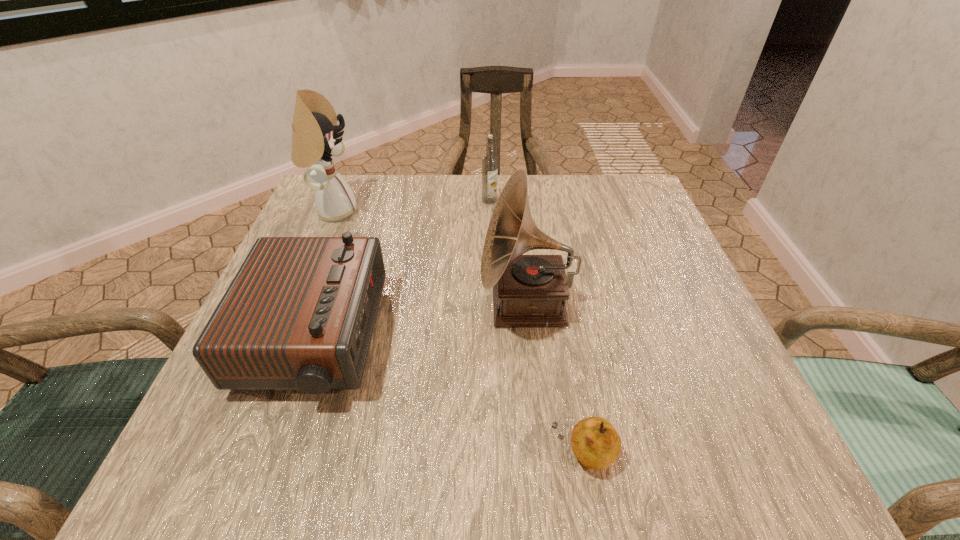
Where is `doll`? doll is located at coordinates (314, 140).

Find the location of a particular element. The width and height of the screenshot is (960, 540). phonograph record is located at coordinates (528, 290).

I want to click on the third shortest object, so click(489, 162).

At what (x,y) coordinates should I click in order to perform the action: click on radio receiver. Please return your answer as a coordinate pair (x, y). Looking at the image, I should click on (299, 314).

You are a GUI agent. You are given a task and a screenshot of the screen. Output one action in this format:
    pyautogui.click(x=<x>, y=<y>)
    Task: Click on the nearest object
    This screenshot has height=540, width=960.
    Given the screenshot: What is the action you would take?
    pyautogui.click(x=596, y=444)

The image size is (960, 540). What are the coordinates of `the shortest object` in the screenshot? It's located at (596, 444).

Where is `vacant position located 0.160m at the front face of the doll`? The image size is (960, 540). vacant position located 0.160m at the front face of the doll is located at coordinates (425, 211).

Locate an element on the screen. vacant area located 0.170m on the horn of the phonograph record is located at coordinates (390, 305).

Image resolution: width=960 pixels, height=540 pixels. What are the coordinates of `vacant region located on the horn of the phonograph record` in the screenshot? It's located at (277, 305).

Where is `vacant space located on the horn of the phonograph record`? vacant space located on the horn of the phonograph record is located at coordinates (331, 305).